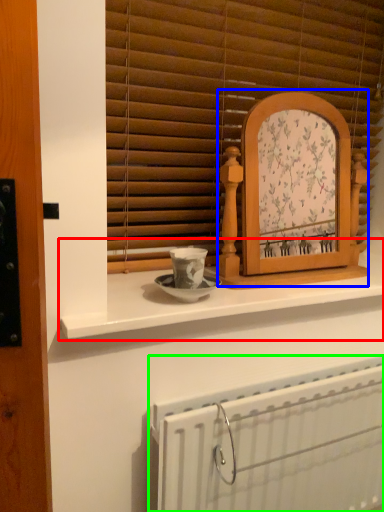
Question: Which object is positioned closest to counter (highlighted by a red box)? Select from picture frame (highlighted by a blue box) and radiator (highlighted by a green box).

Choices:
 (A) picture frame
 (B) radiator

Answer: (A)